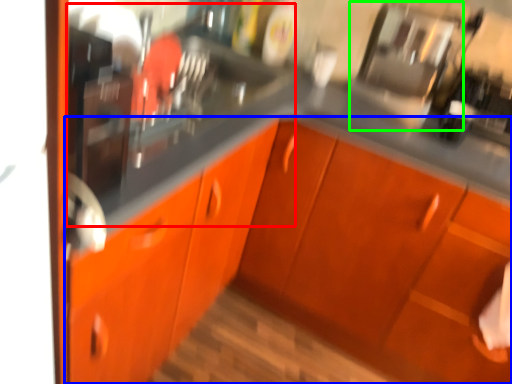
Question: Which object is the closest to the sink (highlighted by a red box)? Choose among these: cabinetry (highlighted by a blue box) or appliance (highlighted by a green box).

Choices:
 (A) cabinetry
 (B) appliance

Answer: (A)